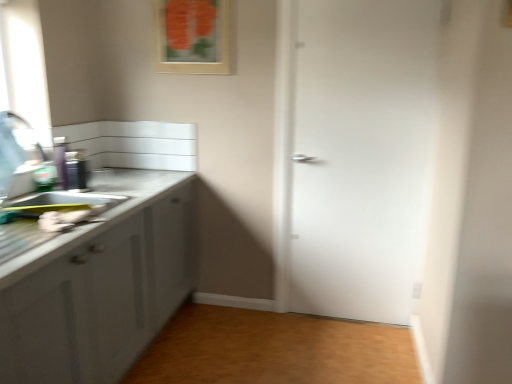
What are the coordinates of `vacant space in front of white matte door at center` in the screenshot? It's located at (350, 350).